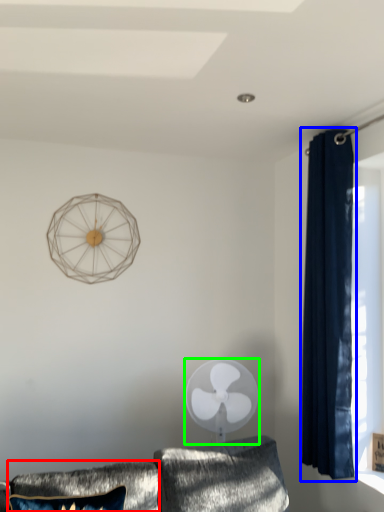
Question: Which object is positioned closest to pillow (highlighted by a red box)? Select from curtain (highlighted by a blue box) and mechanical fan (highlighted by a green box).

Choices:
 (A) curtain
 (B) mechanical fan

Answer: (B)